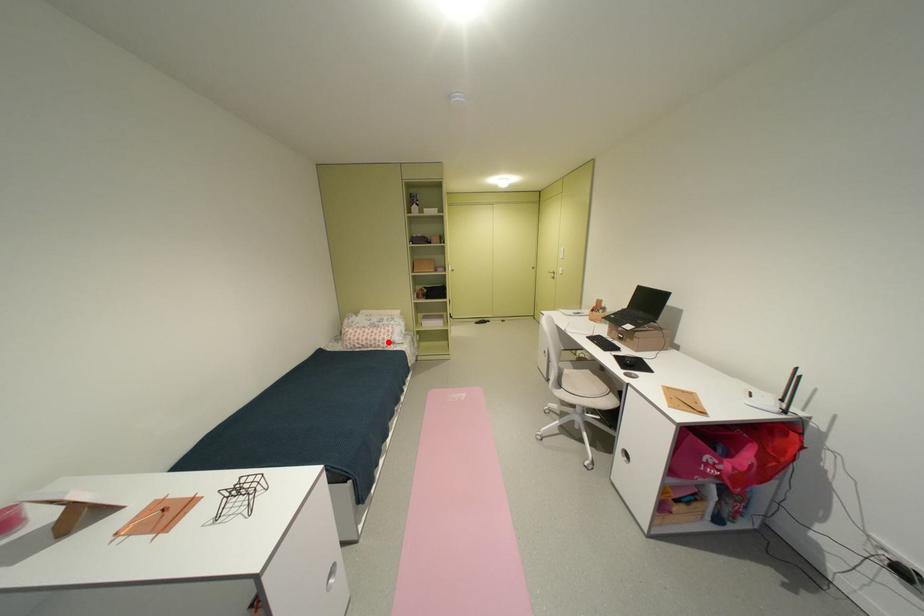
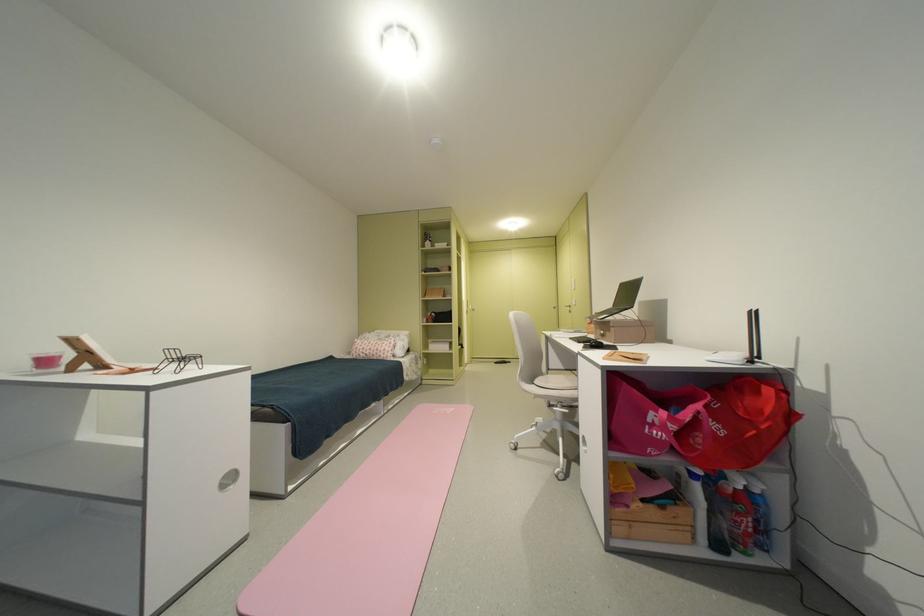
Question: A red point is marked in image1. In image2, is the corresponding 3D point closer to the camera or farther? Reply with the corresponding letter.

Choices:
 (A) The corresponding 3D point is closer.
 (B) The corresponding 3D point is farther.

Answer: (B)